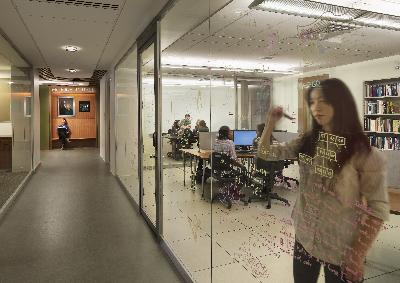
This screenshot has width=400, height=283. Identify the location of marker. (284, 116).